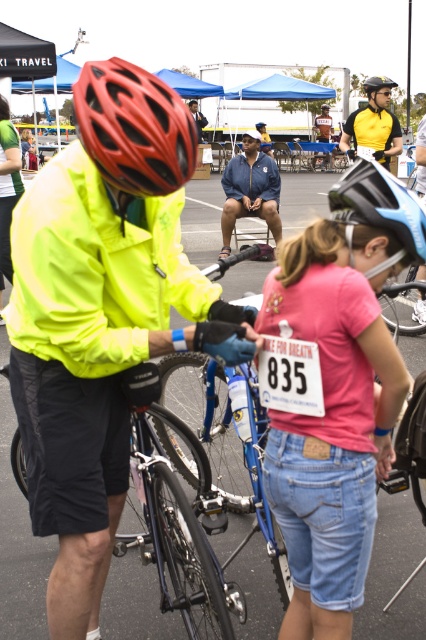
You are a photographer positioned at the back of the scene. You need to capture a clear photo of both the matte black helmet at center and the yellow reflective jacket at center. Considering their heights, which object should you focus on first to ensure it doesn

The matte black helmet at center is much taller than the yellow reflective jacket at center, so you should focus on the matte black helmet at center first to ensure it is in frame before adjusting for the lower positioned jacket.

You are a photographer at the cycling event. You need to capture a photo where both the shiny black bicycle at center and the yellow reflective jacket at center are visible. Based on their positions, which object should be placed on the left side of the frame to ensure both are in the shot?

The shiny black bicycle at center should be placed on the left side of the frame because it is already positioned on the left side of the yellow reflective jacket at center, ensuring both are visible in the photo.